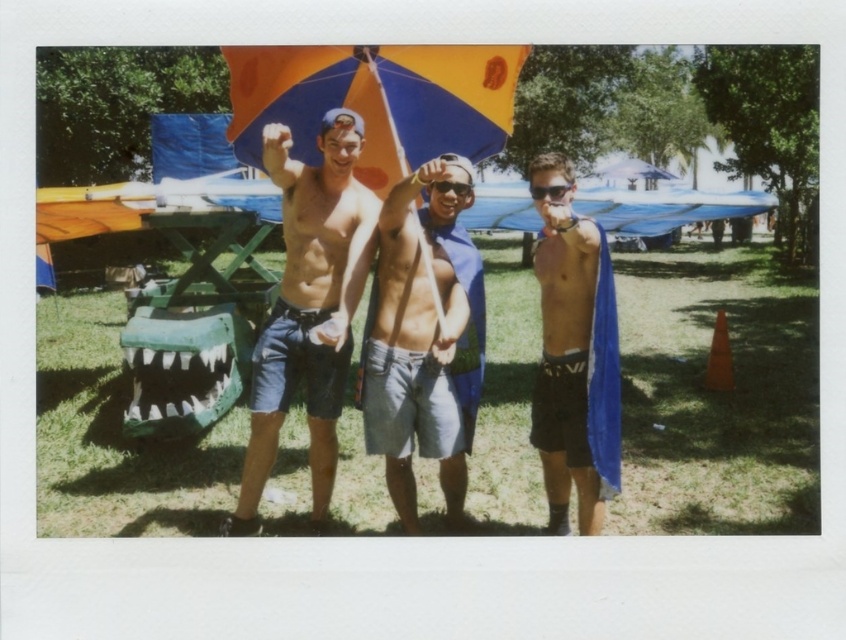
You are a photographer trying to capture a clear shot of the gray cotton shorts at center and the orange and blue umbrella at center. Since you want to focus on the shorts, which object should you adjust your camera to prioritize in terms of height?

The gray cotton shorts at center is much taller than the orange and blue umbrella at center, so you should adjust your camera to prioritize focusing on the gray cotton shorts at center due to its greater height.

You are looking at the image and notice a point marked at coordinates (423, 342). Based on the scene described, which object in the image does this point lie on?

The point at coordinates (423, 342) lies on the gray cotton shorts at center.